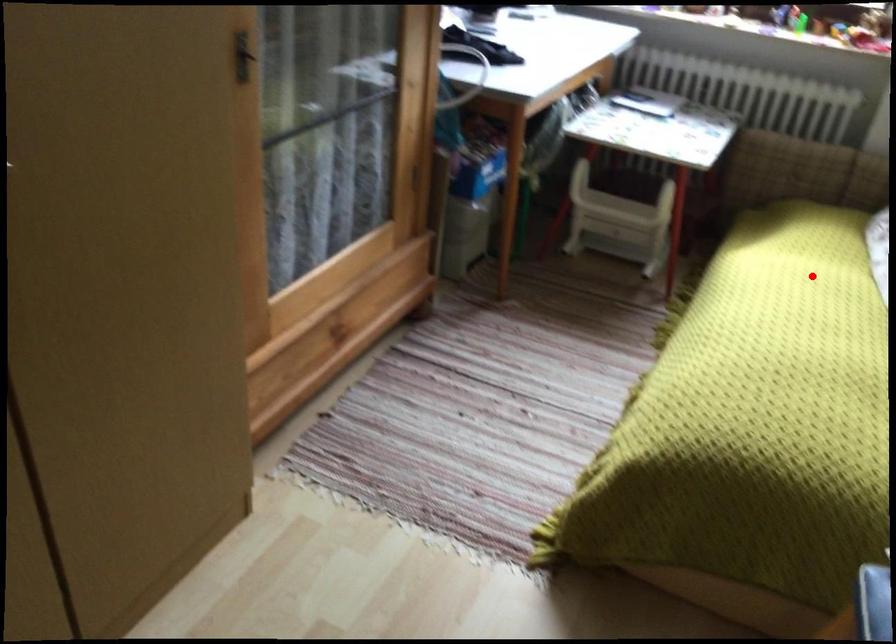
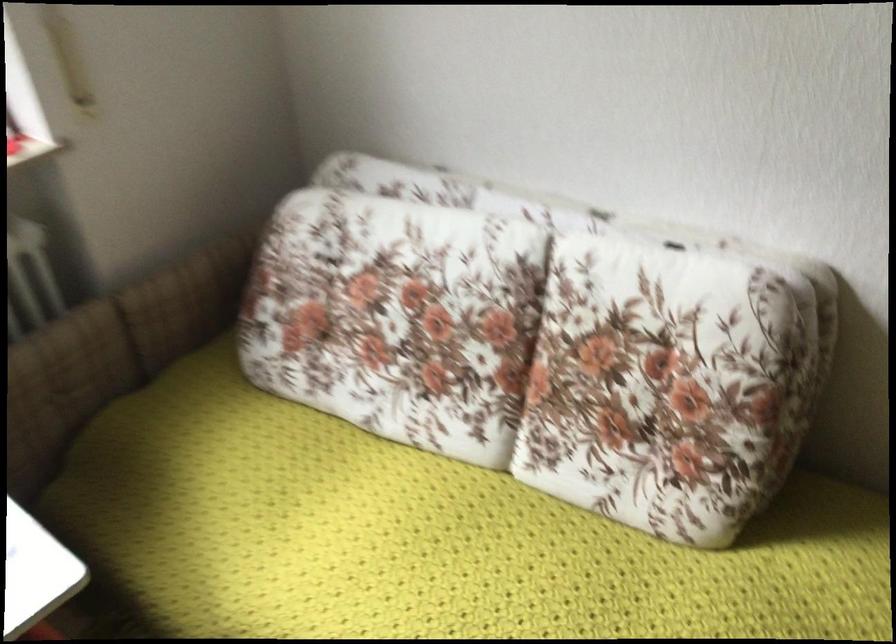
Question: I am providing you with two images of the same scene from different viewpoints. Image1 has a red point marked. In image2, the corresponding 3D location appears at what relative position? Reply with the corresponding letter.

Choices:
 (A) Closer
 (B) Farther

Answer: (A)